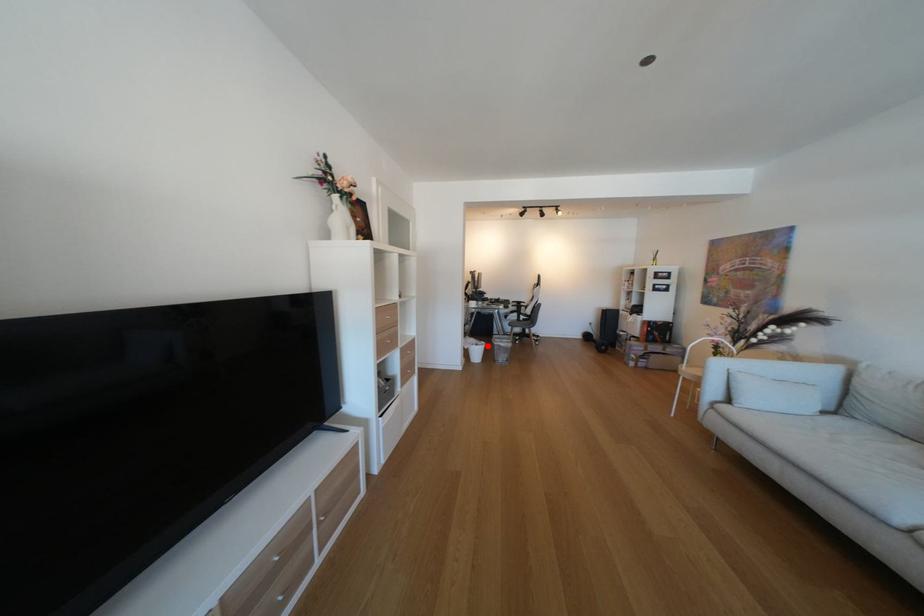
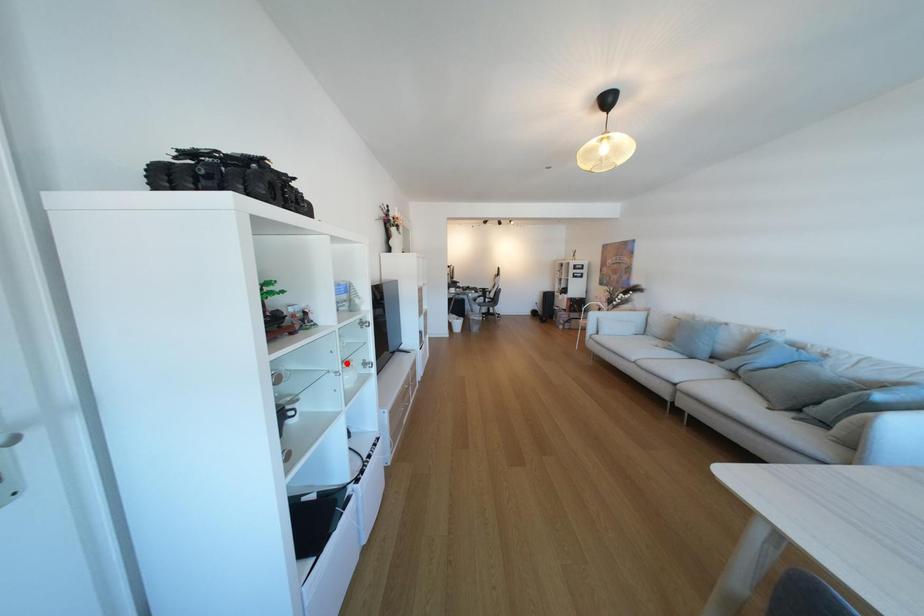
I am providing you with two images of the same scene from different viewpoints. A red point is marked on the first image and another point is marked on the second image. Is the marked point in image1 the same physical position as the marked point in image2?

No